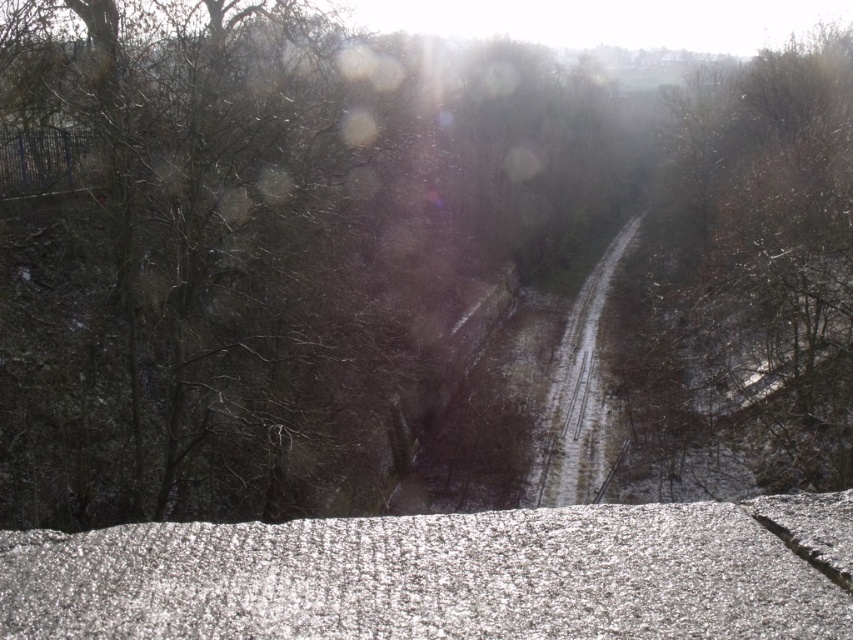
Can you confirm if white granular snow at bottom is positioned below brown leafless tree at right?

Yes, white granular snow at bottom is below brown leafless tree at right.

Can you confirm if white granular snow at bottom is bigger than brown leafless tree at right?

No.

Does point (115, 632) come behind point (665, 348)?

No, (115, 632) is closer to viewer.

Locate an element on the screen. white granular snow at bottom is located at coordinates (444, 576).

Is white granular snow at bottom shorter than snowy gravel train track at center?

Yes, white granular snow at bottom is shorter than snowy gravel train track at center.

Does white granular snow at bottom appear on the right side of snowy gravel train track at center?

In fact, white granular snow at bottom is to the left of snowy gravel train track at center.

Between point (424, 584) and point (624, 227), which one is positioned behind?

The point (624, 227) is more distant.

At what (x,y) coordinates should I click in order to perform the action: click on white granular snow at bottom. Please return your answer as a coordinate pair (x, y). Looking at the image, I should click on (444, 576).

Measure the distance between brown leafless tree at right and snowy gravel train track at center.

A distance of 9.51 meters exists between brown leafless tree at right and snowy gravel train track at center.

Is brown leafless tree at right thinner than snowy gravel train track at center?

Incorrect, brown leafless tree at right's width is not less than snowy gravel train track at center's.

Is point (643, 342) positioned in front of point (590, 486)?

No, (643, 342) is behind (590, 486).

Image resolution: width=853 pixels, height=640 pixels. In order to click on brown leafless tree at right in this screenshot , I will do `click(747, 280)`.